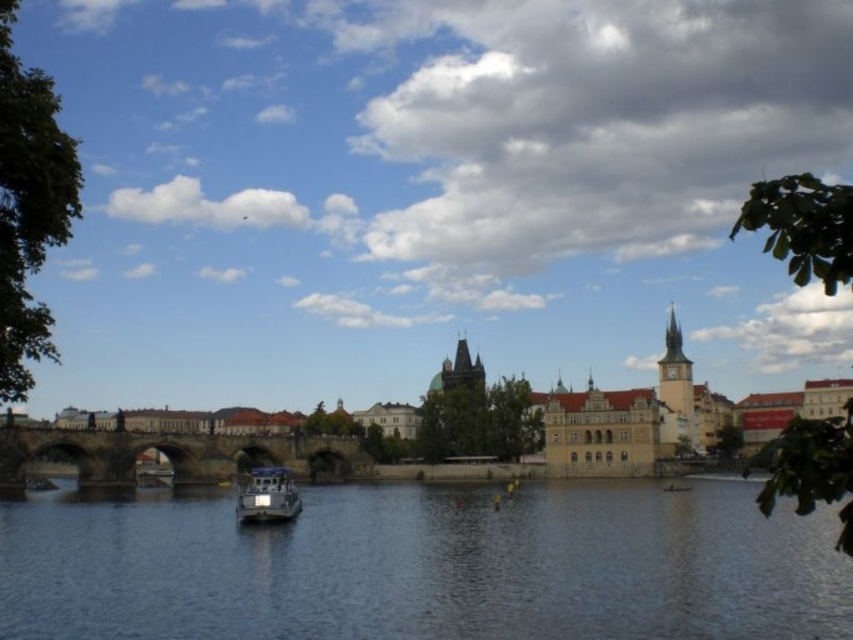
Is dark blue water at center smaller than metallic gray boat at center?

No, dark blue water at center is not smaller than metallic gray boat at center.

Is dark blue water at center bigger than metallic gray boat at center?

Indeed, dark blue water at center has a larger size compared to metallic gray boat at center.

Is point (604, 528) closer to viewer compared to point (258, 488)?

Yes, it is in front of point (258, 488).

Where is `dark blue water at center`? The height and width of the screenshot is (640, 853). dark blue water at center is located at coordinates (426, 566).

Can you confirm if dark blue water at center is positioned to the left of brown stone bridge at center?

No, dark blue water at center is not to the left of brown stone bridge at center.

Who is more distant from viewer, [540,561] or [38,432]?

Positioned behind is point [38,432].

The image size is (853, 640). Find the location of `dark blue water at center`. dark blue water at center is located at coordinates (426, 566).

The height and width of the screenshot is (640, 853). Find the location of `dark blue water at center`. dark blue water at center is located at coordinates (426, 566).

Does brown stone bridge at center have a greater width compared to metallic gray boat at center?

Indeed, brown stone bridge at center has a greater width compared to metallic gray boat at center.

Which is in front, point (41, 428) or point (294, 506)?

Point (294, 506) is in front.

In order to click on brown stone bridge at center in this screenshot , I will do `click(175, 454)`.